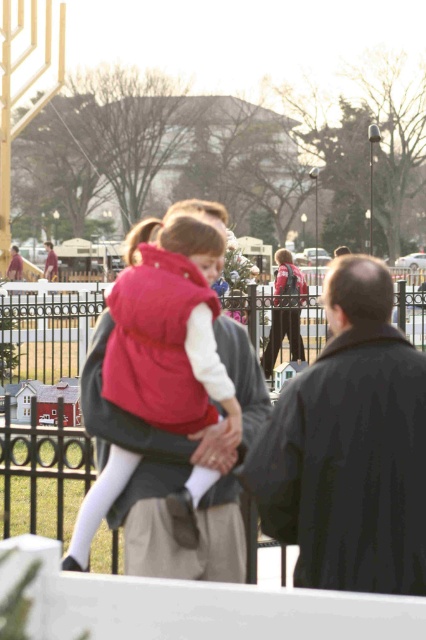
Does black iron fence at center have a greater height compared to matte black jacket at center?

Yes, black iron fence at center is taller than matte black jacket at center.

Who is shorter, black iron fence at center or matte black jacket at center?

Standing shorter between the two is matte black jacket at center.

Who is more distant from viewer, (8,428) or (270,360)?

The point (270,360) is more distant.

Locate an element on the screen. The image size is (426, 640). black iron fence at center is located at coordinates (57, 410).

Is matte red vest at center wider than matte black jacket at center?

Correct, the width of matte red vest at center exceeds that of matte black jacket at center.

Which is behind, point (149, 412) or point (268, 364)?

The point (268, 364) is behind.

Where is `matte red vest at center`? This screenshot has height=640, width=426. matte red vest at center is located at coordinates (169, 330).

Who is lower down, dark brown leather jacket at center or matte black jacket at center?

dark brown leather jacket at center is below.

Where is `dark brown leather jacket at center`? The height and width of the screenshot is (640, 426). dark brown leather jacket at center is located at coordinates (350, 448).

The width and height of the screenshot is (426, 640). What are the coordinates of `dark brown leather jacket at center` in the screenshot? It's located at (350, 448).